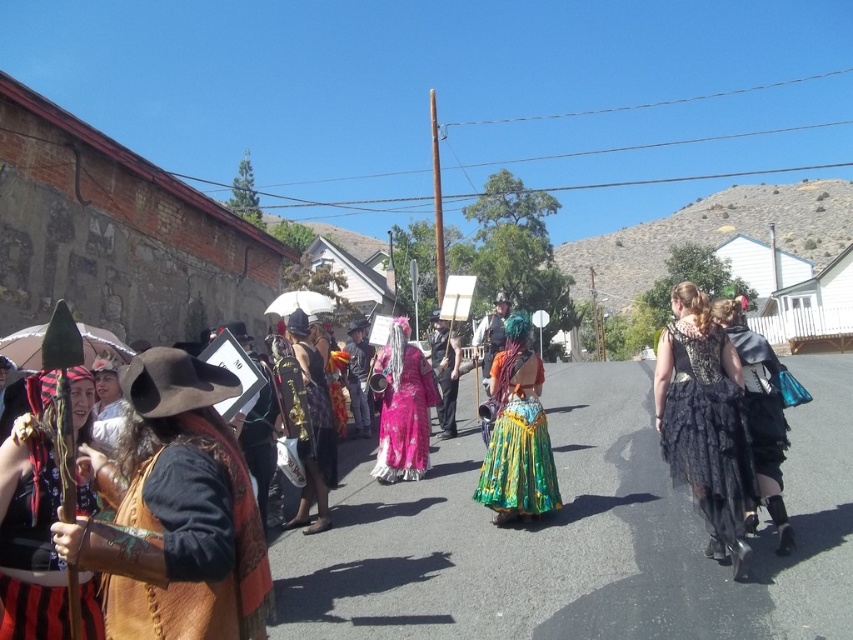
Question: Considering the relative positions of shiny green fabric skirt at center and fuchsia satin dress at center in the image provided, where is shiny green fabric skirt at center located with respect to fuchsia satin dress at center?

Choices:
 (A) below
 (B) above

Answer: (A)

Question: Is fuchsia satin dress at center positioned behind shiny metallic armor at center?

Choices:
 (A) no
 (B) yes

Answer: (A)

Question: Considering the relative positions of velvet black dress at center and leather vest at left in the image provided, where is velvet black dress at center located with respect to leather vest at left?

Choices:
 (A) above
 (B) below

Answer: (B)

Question: Which object appears closest to the camera in this image?

Choices:
 (A) leather vest at left
 (B) white matte umbrella at center
 (C) shiny gold dress at center
 (D) shiny metallic armor at center

Answer: (A)

Question: Among these points, which one is farthest from the camera?

Choices:
 (A) (355, 330)
 (B) (444, 422)
 (C) (735, 454)

Answer: (A)

Question: Which object appears farthest from the camera in this image?

Choices:
 (A) shiny green fabric skirt at center
 (B) leather vest at left
 (C) black lace dress at center
 (D) shiny gold dress at center

Answer: (A)